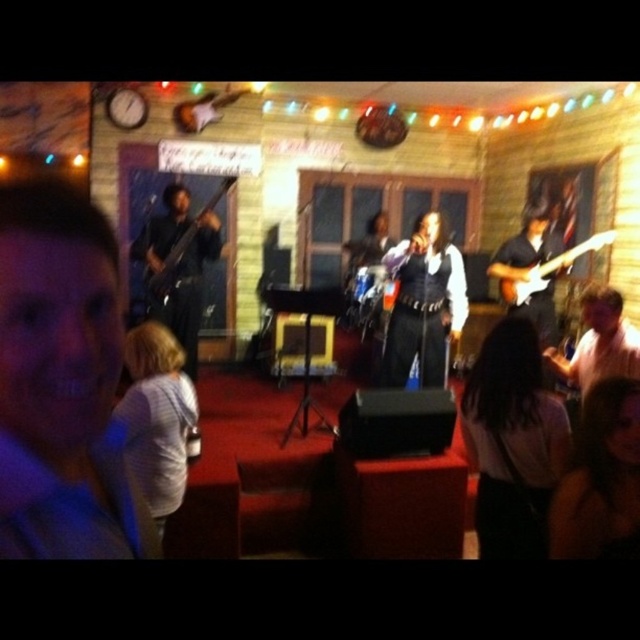
Question: Which point is farther from the camera taking this photo?

Choices:
 (A) (160, 272)
 (B) (545, 337)
 (C) (525, 298)

Answer: (C)

Question: Where is white glossy electric guitar at right located in relation to matte black bass at left in the image?

Choices:
 (A) right
 (B) left

Answer: (A)

Question: Based on their relative distances, which object is nearer to the white glossy electric guitar at right?

Choices:
 (A) glossy wood electric guitar at right
 (B) matte black bass at left

Answer: (A)

Question: Observing the image, what is the correct spatial positioning of white glossy electric guitar at right in reference to glossy wood electric guitar at right?

Choices:
 (A) above
 (B) below

Answer: (B)

Question: Does white glossy electric guitar at right have a lesser width compared to glossy wood electric guitar at right?

Choices:
 (A) yes
 (B) no

Answer: (A)

Question: Among these points, which one is farthest from the camera?

Choices:
 (A) (500, 291)
 (B) (536, 225)
 (C) (193, 234)

Answer: (A)